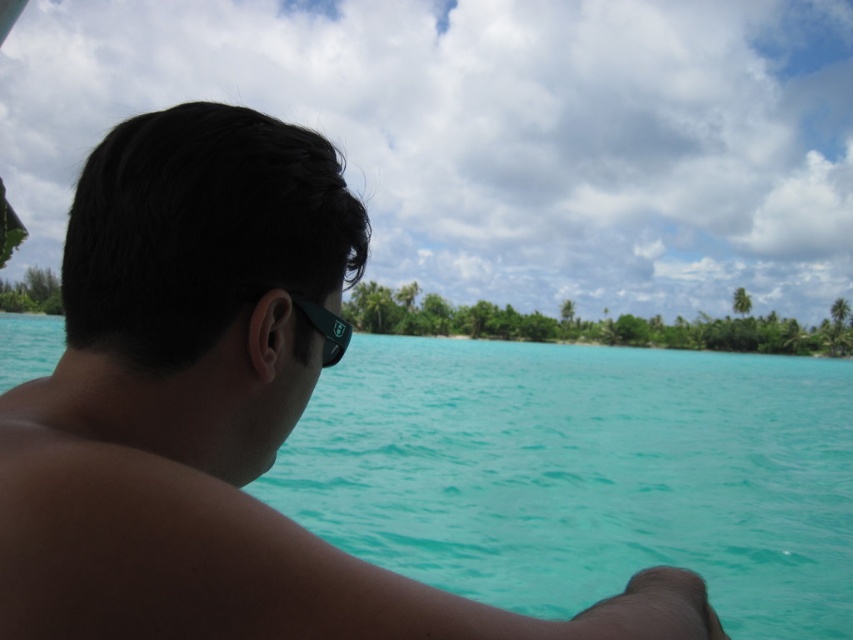
You are a photographer trying to capture a closeup shot of the person in the boat. You have two accessories in view, the matte black sunglasses at upper left and the black rubber goggles at ear. Which accessory should you focus on if you want to capture the larger one in detail?

The matte black sunglasses at upper left is larger in size than the black rubber goggles at ear, so you should focus on the matte black sunglasses at upper left to capture the larger one in detail.

Based on the photo, you are on a boat and want to know if a point in the water is within arm reach. The point is located at coordinates point (198, 529). Your arm can reach up to 20 inches. Can you reach it?

The point (198, 529) is 21.85 inches from the camera, which is beyond your arm reach of 20 inches. You cannot reach it.

You are standing on the boat and looking at the scene. There is a point marked at coordinates [216,413] in the image. What object is located at that point?

The point at coordinates [216,413] corresponds to the matte black sunglasses at upper left.